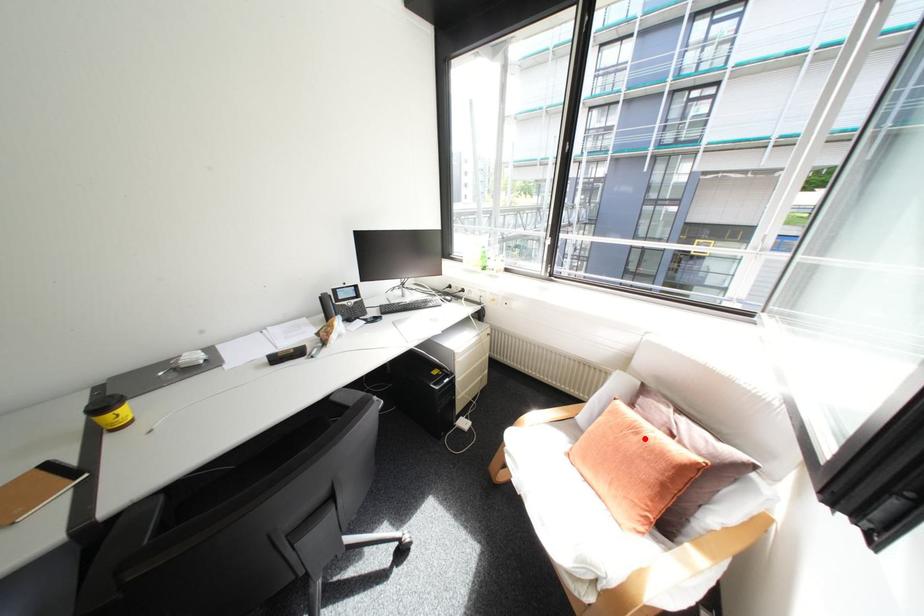
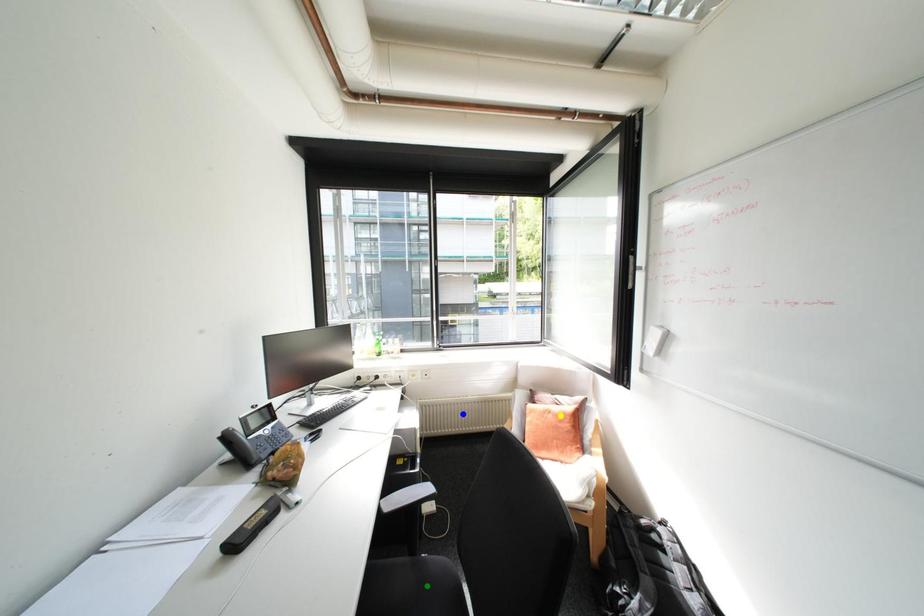
Question: I am providing you with two images of the same scene from different viewpoints. A red point is marked on the first image. You are given multiple points on the second image. Which point in image 2 is actually the same real-world point as the red point in image 1?

Choices:
 (A) yellow point
 (B) green point
 (C) blue point

Answer: (A)